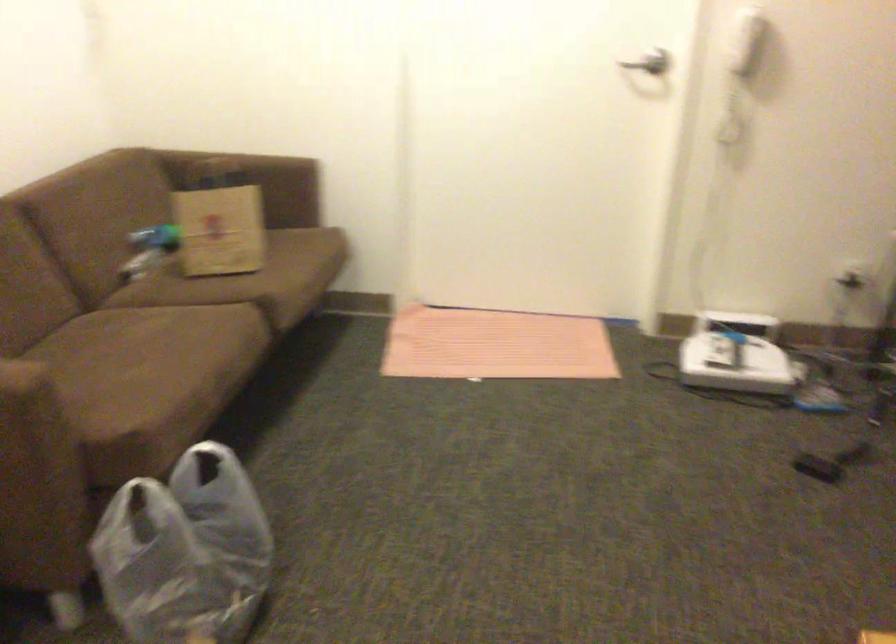
Where would you pull the silver door handle? Please return your answer as a coordinate pair (x, y).

(650, 62)